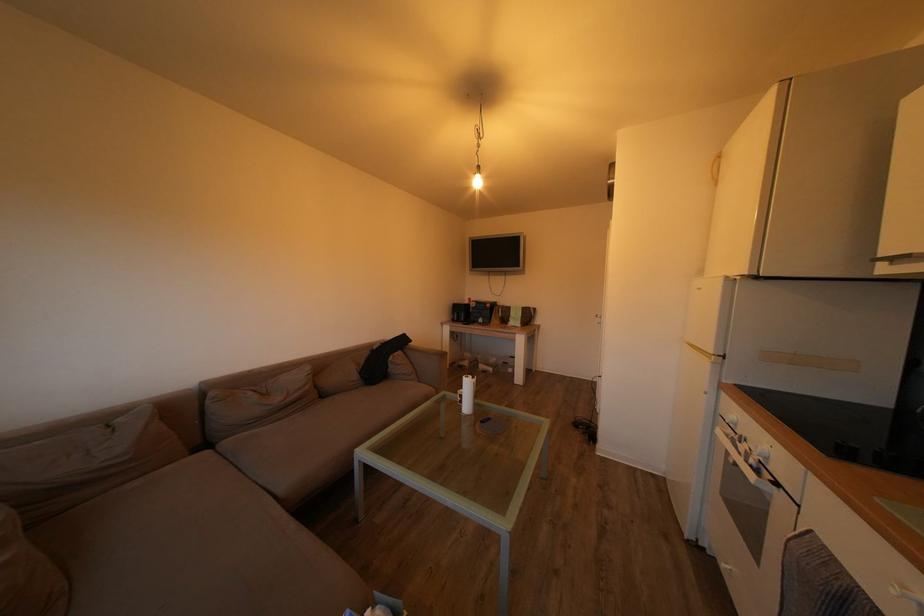
You are a GUI agent. You are given a task and a screenshot of the screen. Output one action in this format:
    pyautogui.click(x=<x>, y=<y>)
    Task: Click on the sofa armrest
    Image resolution: width=924 pixels, height=616 pixels.
    Given the screenshot: What is the action you would take?
    click(429, 365)